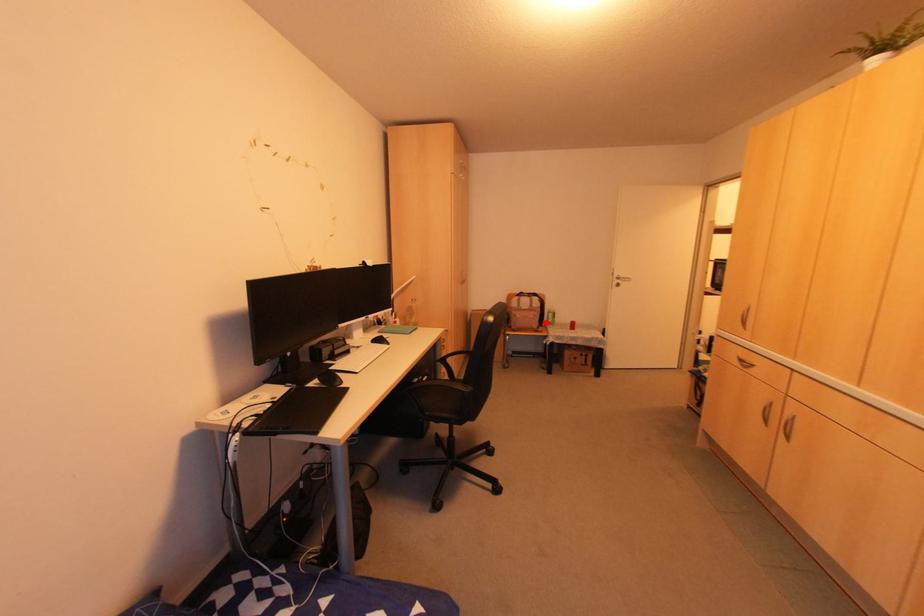
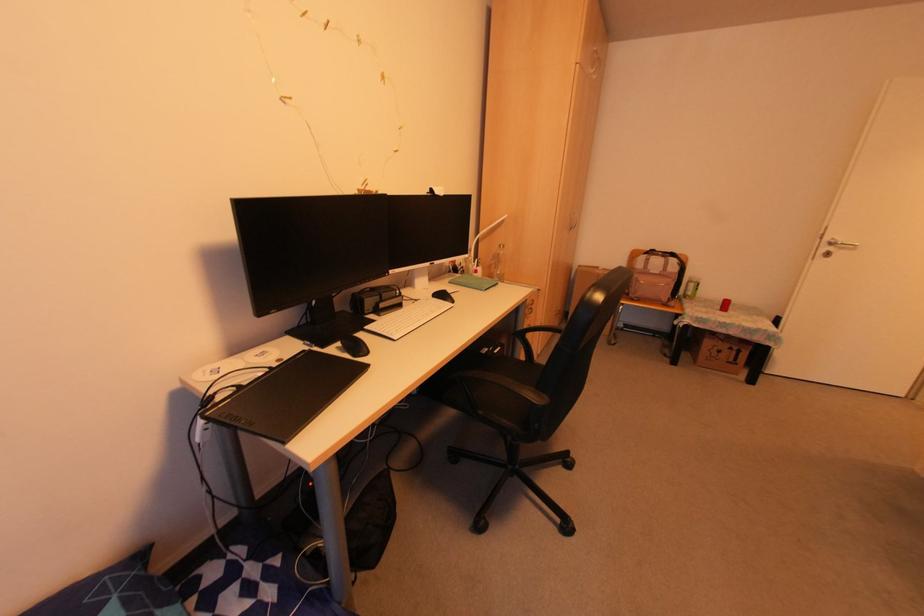
Locate, in the second image, the point that corresponds to the highlighted location in the first image.

(683, 296)